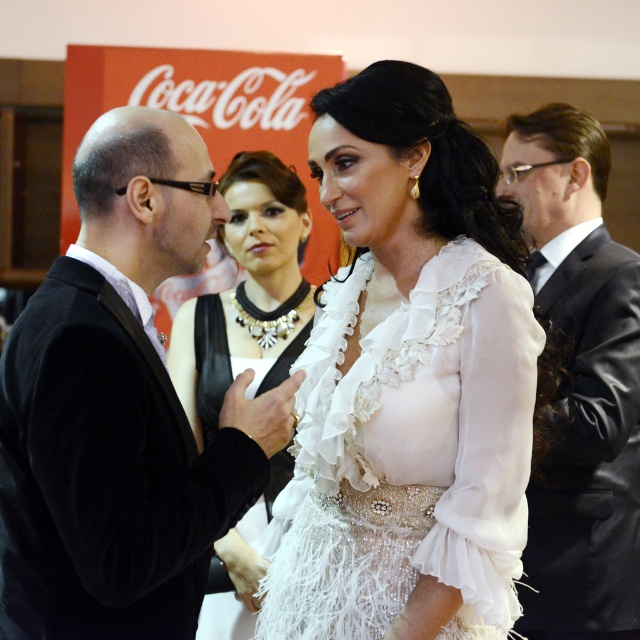
You are a photographer at a formal event. You need to capture a photo of both the white sheer dress at center and the black satin suit at right. Based on their positions, which one should you focus on first to ensure both are in frame?

The white sheer dress at center is positioned on the left side of the black satin suit at right, so focus on the black satin suit at right first to ensure both are in frame.

Consider the image. You are a photographer at a formal event and need to capture a group photo of the black satin suit at right and the white lace dress at center. If your camera has a minimum focus distance of 4 feet, will you be able to take a clear photo of both subjects without moving them?

The distance between the black satin suit at right and white lace dress at center is 3.55 feet, which is less than the camera minimum focus distance of 4 feet. Therefore, you will not be able to take a clear photo of both subjects without moving them closer together.